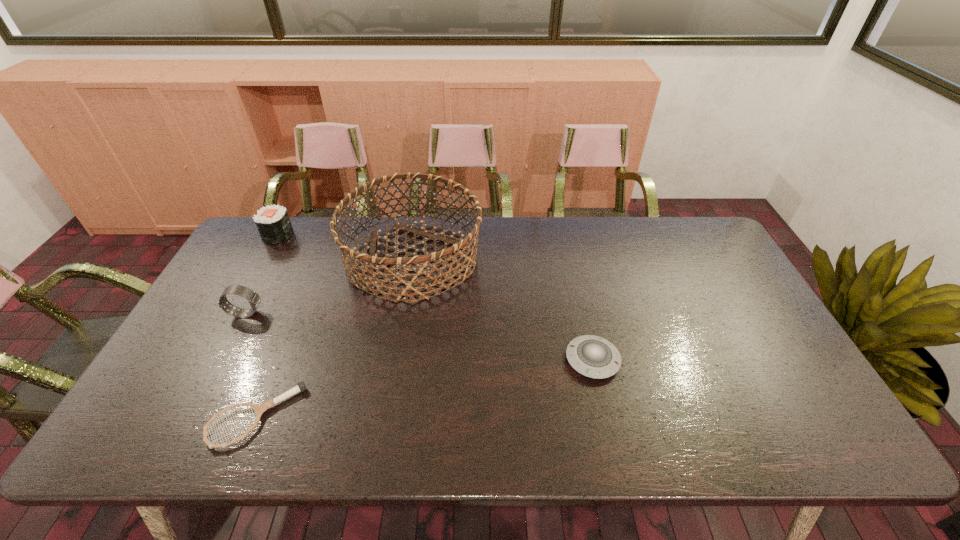
This screenshot has height=540, width=960. I want to click on free area in between the watch and the sushi, so click(262, 274).

Locate which object ranks fourth in proximity to the fourth farthest object. Please provide its 2D coordinates. Your answer should be formatted as a tuple, i.e. [(x, y)], where the tuple contains the x and y coordinates of a point satisfying the conditions above.

[(273, 223)]

The image size is (960, 540). In order to click on the second closest object to the nearest object in this screenshot , I will do `click(371, 258)`.

Where is `vacant space that satisfies the following two spatial constraints: 1. on the front side of the sushi; 2. on the left side of the tallest object`? This screenshot has height=540, width=960. vacant space that satisfies the following two spatial constraints: 1. on the front side of the sushi; 2. on the left side of the tallest object is located at coordinates (265, 259).

The height and width of the screenshot is (540, 960). In order to click on vacant space that satisfies the following two spatial constraints: 1. on the face of the watch; 2. on the left side of the shortest object in this screenshot , I will do `click(192, 416)`.

Find the location of a particular element. The height and width of the screenshot is (540, 960). vacant region that satisfies the following two spatial constraints: 1. on the back side of the shortest object; 2. on the face of the watch is located at coordinates (298, 314).